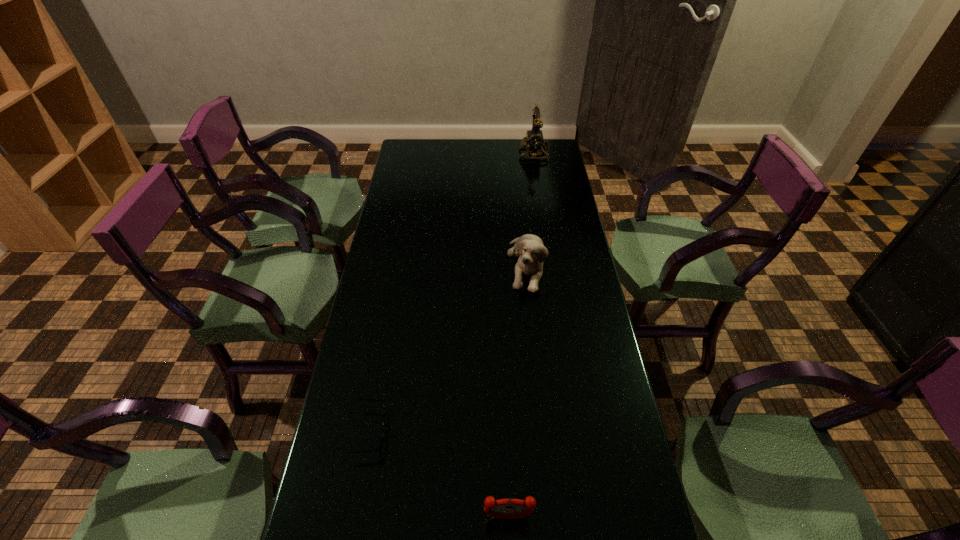
Where is `blank space located 0.080m on the front of the tallest object, featuring the rotary dial`? This screenshot has width=960, height=540. blank space located 0.080m on the front of the tallest object, featuring the rotary dial is located at coordinates click(502, 153).

Identify the location of vacant space situated on the front-facing side of the third shortest object. Image resolution: width=960 pixels, height=540 pixels. (532, 315).

Where is `vacant space situated 0.110m on the front-facing side of the shortest object`? This screenshot has height=540, width=960. vacant space situated 0.110m on the front-facing side of the shortest object is located at coordinates (430, 431).

This screenshot has height=540, width=960. Find the location of `object that is at the far edge`. object that is at the far edge is located at coordinates (534, 138).

Identify the location of object present at the left edge. (378, 446).

Identify the location of telephone that is at the right edge. The height and width of the screenshot is (540, 960). (534, 138).

This screenshot has height=540, width=960. Find the location of `puppy situated at the right edge`. puppy situated at the right edge is located at coordinates (532, 252).

Find the location of a particular element. The height and width of the screenshot is (540, 960). object present at the far right corner is located at coordinates (534, 138).

This screenshot has width=960, height=540. In the image, there is a desktop. Find the location of `free space at the far edge`. free space at the far edge is located at coordinates (450, 151).

This screenshot has height=540, width=960. Find the location of `vacant area at the left edge`. vacant area at the left edge is located at coordinates (382, 472).